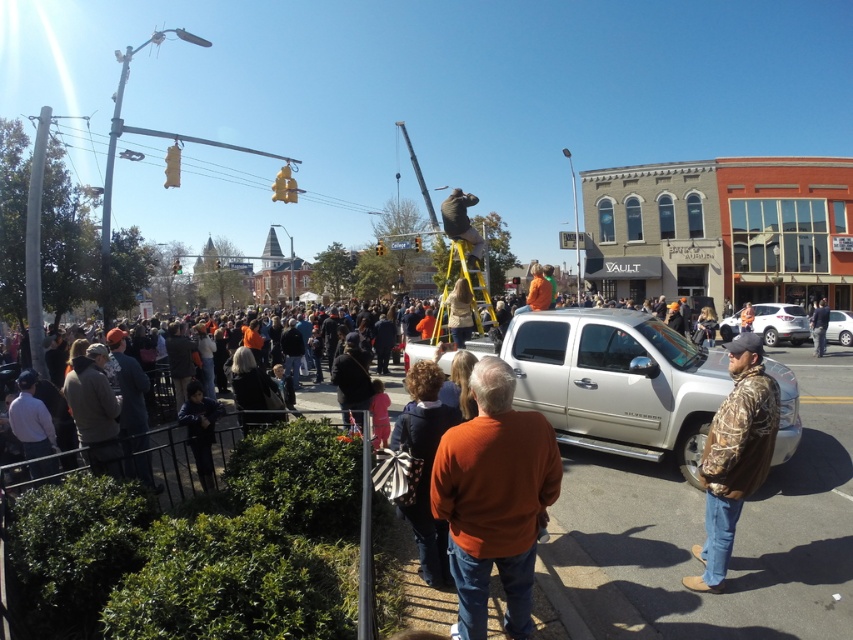
You are standing at the center of the image and see a point marked at coordinates (734, 456). Which object is this point located on?

The point at coordinates (734, 456) is located on the camo jacket at center.

You are a photographer standing at the intersection and want to take a photo of both the white matte pickup truck at center and the matte brown bear at center. Which object should you focus on first to ensure both are in sharp focus?

You should focus on the white matte pickup truck at center first because it is closer to the viewer than the matte brown bear at center, so focusing on the closer object will help keep both in focus.

You are a photographer trying to capture both the camo jacket at center and the matte brown bear at center in a single shot. Which object should you focus on first to ensure both are in clear view?

You should focus on the camo jacket at center first because it is closer to the viewer than the matte brown bear at center. By focusing on the closer object, the depth of field may allow the matte brown bear at center to also be in focus.